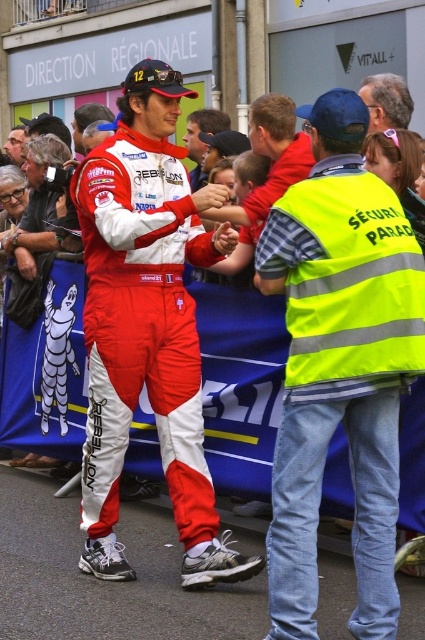
Is the position of neon yellow reflective vest at center less distant than that of white synthetic sneakers at lower center?

Yes, it is.

Is point (363, 596) positioned behind point (142, 508)?

That is False.

Image resolution: width=425 pixels, height=640 pixels. In order to click on neon yellow reflective vest at center in this screenshot , I will do `click(340, 365)`.

Who is positioned more to the right, matte red racing suit at center or white synthetic sneakers at lower center?

Answer: matte red racing suit at center

Which is behind, point (163, 81) or point (217, 592)?

The point (163, 81) is behind.

At what (x,y) coordinates should I click in order to perform the action: click on matte red racing suit at center. Please return your answer as a coordinate pair (x, y). The image size is (425, 640). Looking at the image, I should click on (147, 324).

Can you confirm if neon yellow reflective vest at center is smaller than matte red racing suit at center?

Indeed, neon yellow reflective vest at center has a smaller size compared to matte red racing suit at center.

Does neon yellow reflective vest at center have a lesser width compared to matte red racing suit at center?

Yes, neon yellow reflective vest at center is thinner than matte red racing suit at center.

I want to click on neon yellow reflective vest at center, so click(x=340, y=365).